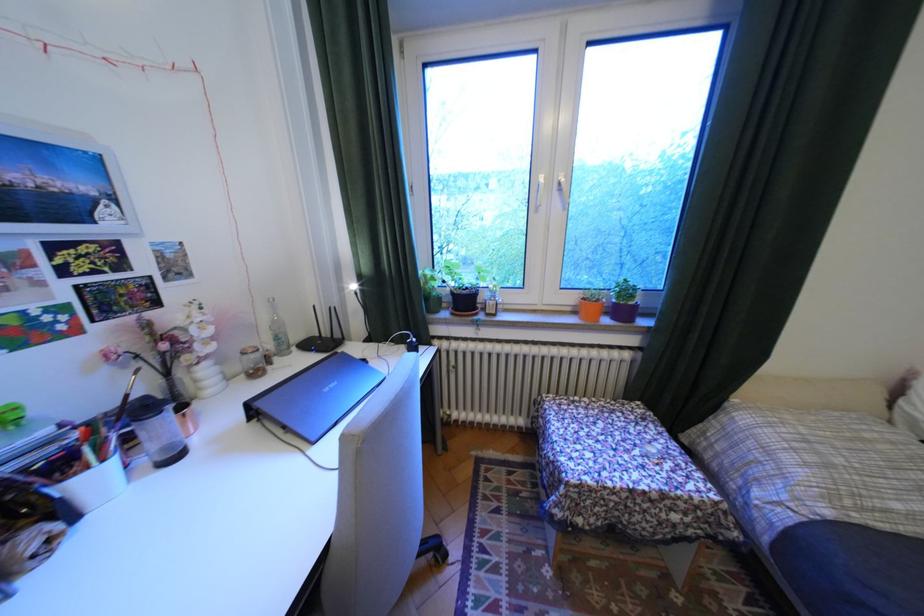
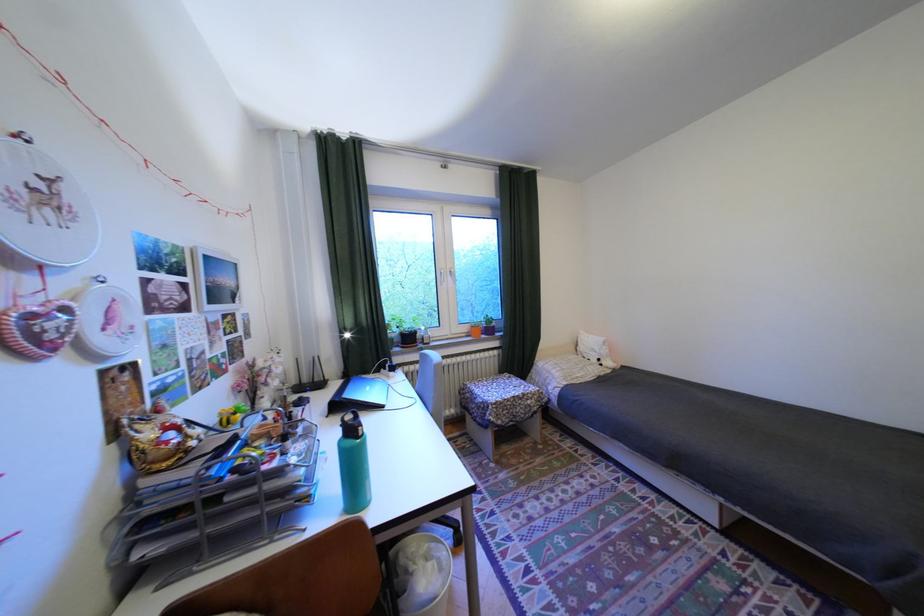
Where in the second image is the point corresponding to the point at 601,294 from the first image?

(485, 325)